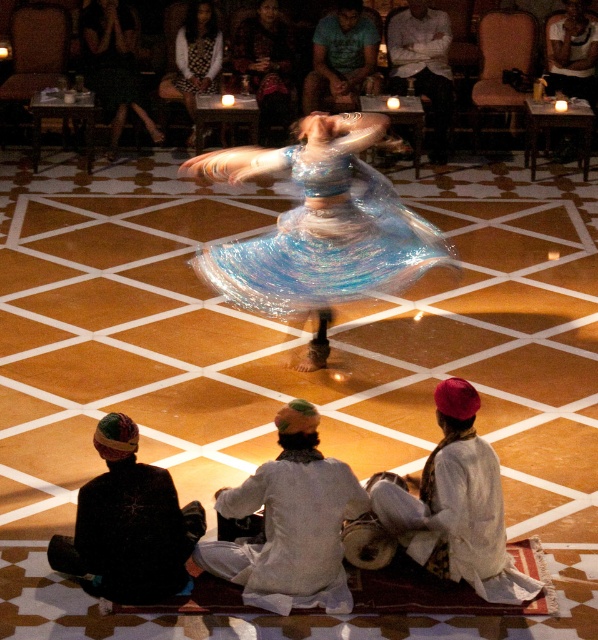
Who is higher up, white cotton turban at lower right or shiny black dress at upper center?

Positioned higher is shiny black dress at upper center.

Is white cotton turban at lower right smaller than shiny black dress at upper center?

Indeed, white cotton turban at lower right has a smaller size compared to shiny black dress at upper center.

Does point (392, 492) come farther from viewer compared to point (99, 52)?

No.

The width and height of the screenshot is (598, 640). In order to click on white cotton turban at lower right in this screenshot , I will do tap(456, 506).

Who is more forward, (440, 93) or (331, 88)?

Point (440, 93) is more forward.

Between white shirt at upper center and blue cotton shirt at upper center, which one is positioned higher?

Positioned higher is blue cotton shirt at upper center.

Between point (432, 51) and point (315, 97), which one is positioned behind?

Positioned behind is point (315, 97).

Where is `white shirt at upper center`? The width and height of the screenshot is (598, 640). white shirt at upper center is located at coordinates (422, 64).

Can you confirm if dark brown leather jacket at lower left is taller than white dotted dress at upper center?

No.

Does dark brown leather jacket at lower left appear over white dotted dress at upper center?

Actually, dark brown leather jacket at lower left is below white dotted dress at upper center.

Which is behind, point (139, 577) or point (208, 3)?

The point (208, 3) is more distant.

This screenshot has width=598, height=640. What are the coordinates of `dark brown leather jacket at lower left` in the screenshot? It's located at (129, 524).